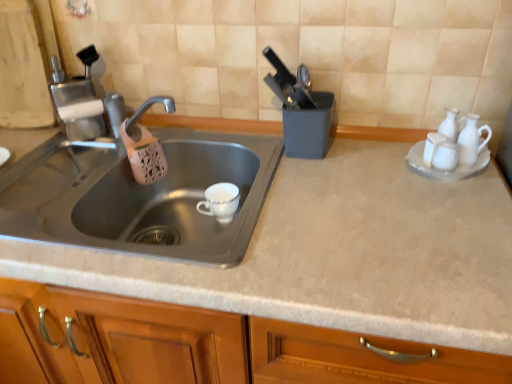
Question: Is stainless steel sink at left completely or partially outside of white glossy salt shaker at upper right, which is the second tableware in left-to-right order?

Choices:
 (A) yes
 (B) no

Answer: (A)

Question: Does stainless steel sink at left have a smaller size compared to white glossy salt shaker at upper right, positioned as the 2th tableware in right-to-left order?

Choices:
 (A) no
 (B) yes

Answer: (A)

Question: Is the depth of stainless steel sink at left less than that of white glossy salt shaker at upper right, which is the second tableware in left-to-right order?

Choices:
 (A) no
 (B) yes

Answer: (B)

Question: Is white glossy salt shaker at upper right, positioned as the second tableware in front-to-back order, inside stainless steel sink at left?

Choices:
 (A) yes
 (B) no

Answer: (B)

Question: From a real-world perspective, is stainless steel sink at left beneath white glossy salt shaker at upper right, positioned as the 2th tableware in right-to-left order?

Choices:
 (A) no
 (B) yes

Answer: (B)

Question: Considering the positions of white glossy salt shaker at upper right, positioned as the second tableware in front-to-back order, and stainless steel sink at left in the image, is white glossy salt shaker at upper right, positioned as the second tableware in front-to-back order, taller or shorter than stainless steel sink at left?

Choices:
 (A) tall
 (B) short

Answer: (B)

Question: From the image's perspective, relative to stainless steel sink at left, is white glossy salt shaker at upper right, arranged as the 2th tableware when viewed from the back, above or below?

Choices:
 (A) above
 (B) below

Answer: (A)

Question: In terms of size, does white glossy salt shaker at upper right, positioned as the 2th tableware in right-to-left order, appear bigger or smaller than stainless steel sink at left?

Choices:
 (A) big
 (B) small

Answer: (B)

Question: Considering their positions, is white glossy salt shaker at upper right, positioned as the second tableware in front-to-back order, located in front of or behind stainless steel sink at left?

Choices:
 (A) behind
 (B) front

Answer: (A)

Question: From the image's perspective, relative to white porcelain cup at sink, positioned as the third tableware in right-to-left order, is matte gray countertop at center above or below?

Choices:
 (A) above
 (B) below

Answer: (B)

Question: Is point (348, 142) positioned closer to the camera than point (208, 195)?

Choices:
 (A) farther
 (B) closer

Answer: (A)

Question: Is matte gray countertop at center in front of or behind white porcelain cup at sink, which appears as the 1th tableware when viewed from the left, in the image?

Choices:
 (A) front
 (B) behind

Answer: (A)

Question: Would you say matte gray countertop at center is to the left or to the right of white porcelain cup at sink, which appears as the 1th tableware when viewed from the left, in the picture?

Choices:
 (A) left
 (B) right

Answer: (B)

Question: Relative to white ceramic saucer at right, is white glossy salt shaker at upper right, arranged as the 2th tableware when viewed from the back, in front or behind?

Choices:
 (A) front
 (B) behind

Answer: (B)

Question: Is white glossy salt shaker at upper right, which is the second tableware in left-to-right order, bigger or smaller than white ceramic saucer at right?

Choices:
 (A) big
 (B) small

Answer: (B)